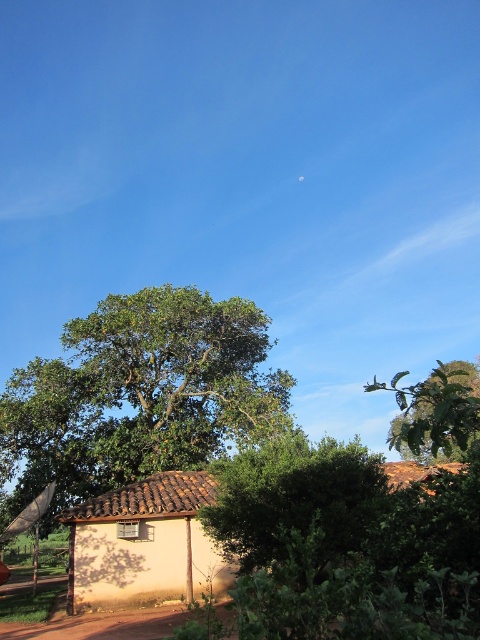
You are standing in the rural scene and want to take a photo of the green leafy tree at center. According to the coordinates provided, where should you position yourself to capture the tree in the frame?

You should position yourself at point (140, 394) to capture the green leafy tree at center in the frame as it is located at those coordinates.

You are standing in front of the rustic building and want to see the view beyond the trees. Which tree, the green leafy tree at center or the green leafy tree at upper right, would block your view more?

The green leafy tree at upper right is behind green leafy tree at center, so the green leafy tree at center would block your view more as it is closer to you.